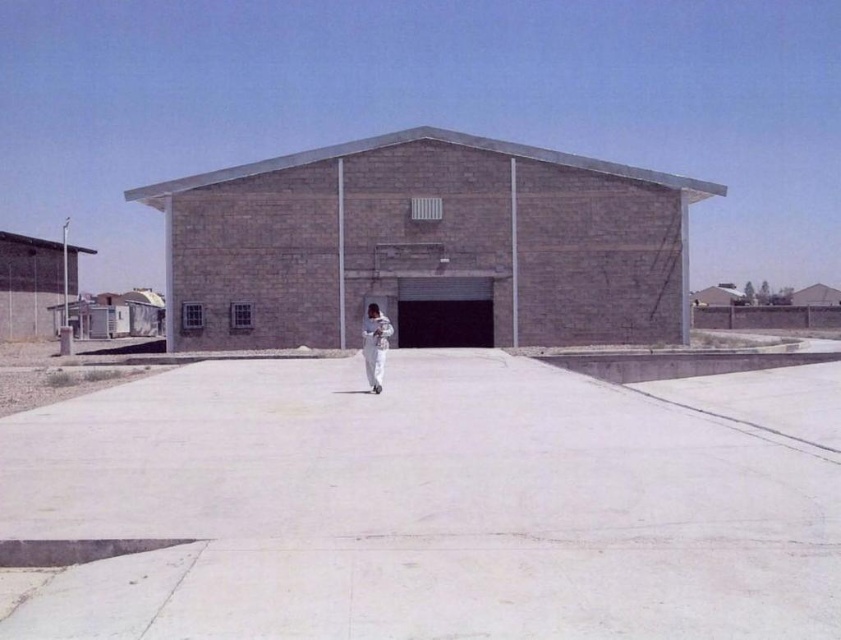
Does white concrete pavement at center have a lesser width compared to white matte jumpsuit at center?

Incorrect, white concrete pavement at center's width is not less than white matte jumpsuit at center's.

Measure the distance between white concrete pavement at center and camera.

white concrete pavement at center and camera are 14.31 feet apart.

Image resolution: width=841 pixels, height=640 pixels. I want to click on white concrete pavement at center, so click(x=427, y=504).